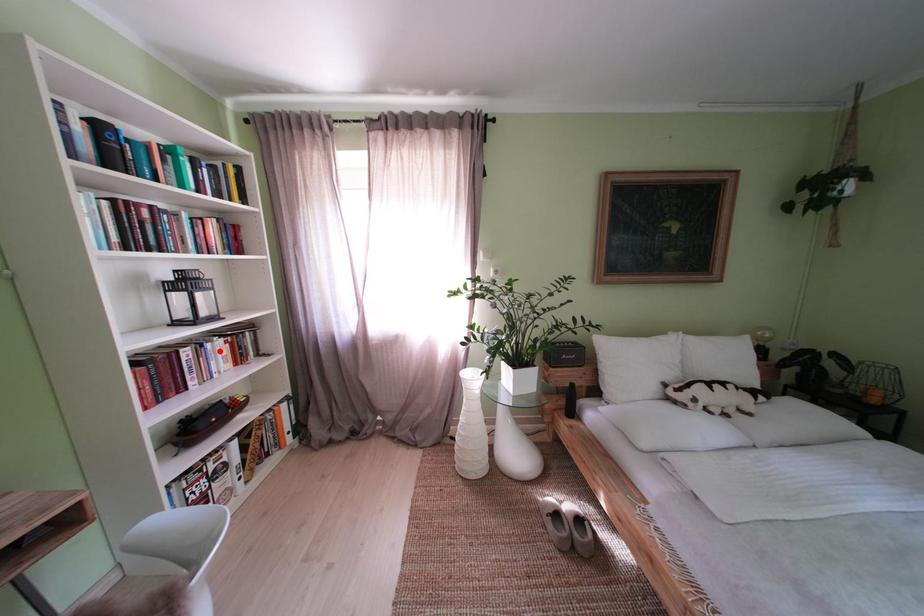
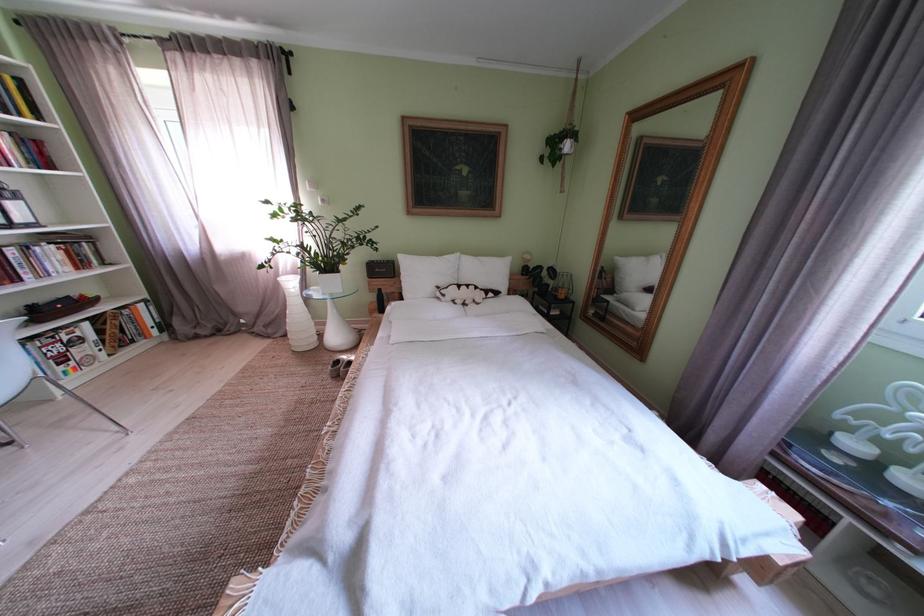
Question: I am providing you with two images of the same scene from different viewpoints. A red point is shown in image1. For the corresponding object point in image2, is it positioned nearer or farther from the camera?

Choices:
 (A) Nearer
 (B) Farther

Answer: (B)